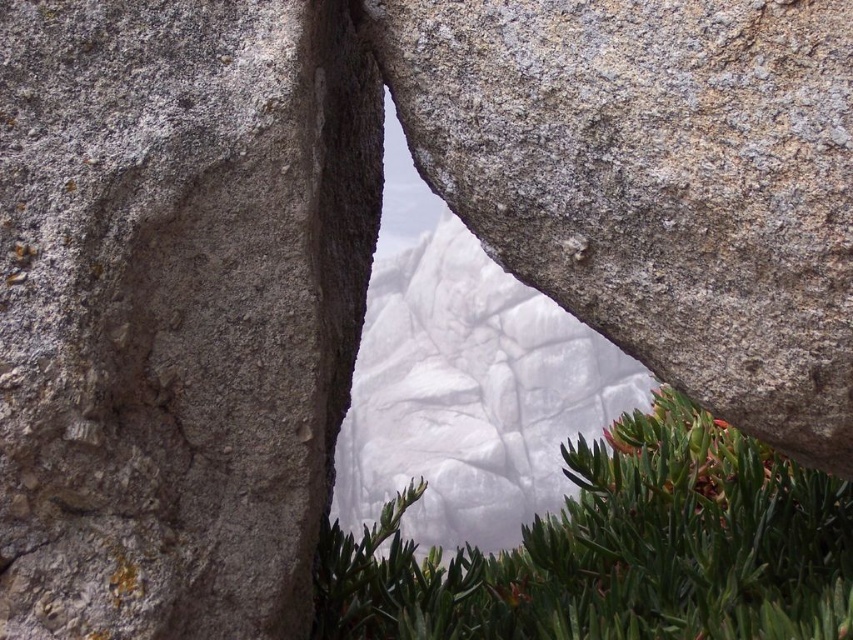
You are a hiker trying to navigate through a narrow path between the gray rough rock at left and the green leafy plant at center. If the path is only 1 meter wide, can you pass through it comfortably?

The gray rough rock at left is narrower than the green leafy plant at center, but the exact width of the path isn t specified. However, since the path is 1 meter wide, you should be able to pass through it comfortably as long as your body width is less than 1 meter.

You are standing in front of a rocky landscape with a narrow opening between two large rocks. You notice a gray rough rock at left and a green leafy plant at center. Which object is positioned to the left of the other?

The gray rough rock at left is to the left of the green leafy plant at center.

You are an explorer trying to pass through the narrow opening between the gray rough rock at left and the gray rough boulder at center. Based on their thickness, which rock would you need to move to create more space?

The gray rough rock at left is thinner than the gray rough boulder at center, so you would need to move the gray rough boulder at center to create more space since it is thicker.